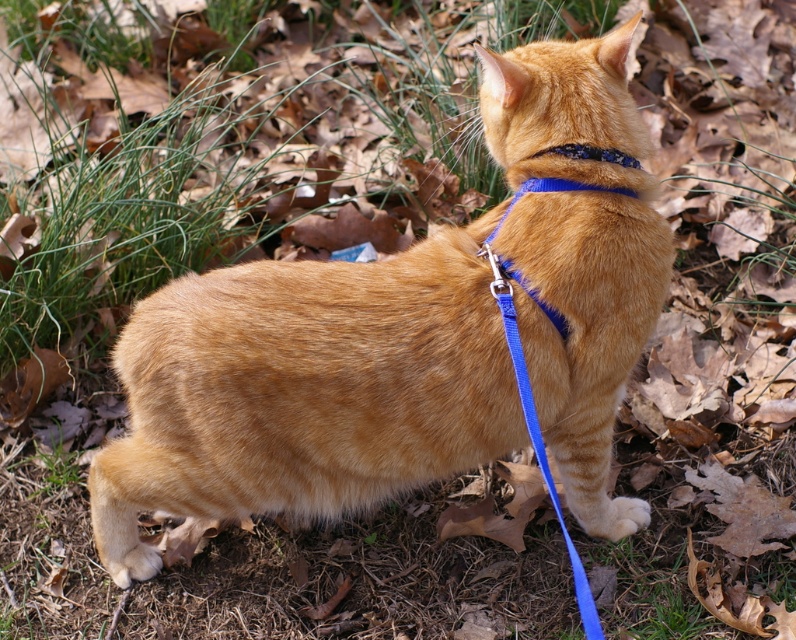
Between point (541, 454) and point (618, 150), which one is positioned behind?

Positioned behind is point (618, 150).

Who is more distant from viewer, (517, 372) or (631, 156)?

Point (631, 156)

You are a GUI agent. You are given a task and a screenshot of the screen. Output one action in this format:
    pyautogui.click(x=<x>, y=<y>)
    Task: Click on the blue fabric leash at center-right
    The width and height of the screenshot is (796, 640).
    Given the screenshot: What is the action you would take?
    pyautogui.click(x=537, y=435)

Is point (420, 288) positioned before point (619, 154)?

Yes, point (420, 288) is in front of point (619, 154).

Looking at this image, who is taller, orange fur cat at center or shiny blue collar at upper center?

With more height is orange fur cat at center.

In order to click on orange fur cat at center in this screenshot , I will do `click(408, 337)`.

Can you confirm if orange fur cat at center is wider than blue fabric leash at center-right?

Correct, the width of orange fur cat at center exceeds that of blue fabric leash at center-right.

Between point (344, 420) and point (492, 291), which one is positioned in front?

Positioned in front is point (492, 291).

Who is more distant from viewer, (597, 493) or (498, 285)?

The point (597, 493) is more distant.

Where is `orange fur cat at center`? orange fur cat at center is located at coordinates (408, 337).